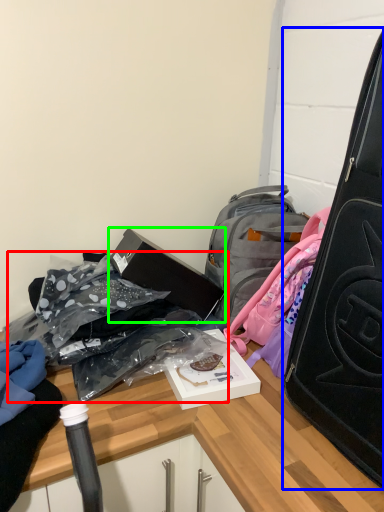
Question: Estimate the real-world distances between objects in this image. Which object is closer to bag (highlighted by a red box), suitcase (highlighted by a blue box) or box (highlighted by a green box)?

Choices:
 (A) suitcase
 (B) box

Answer: (B)